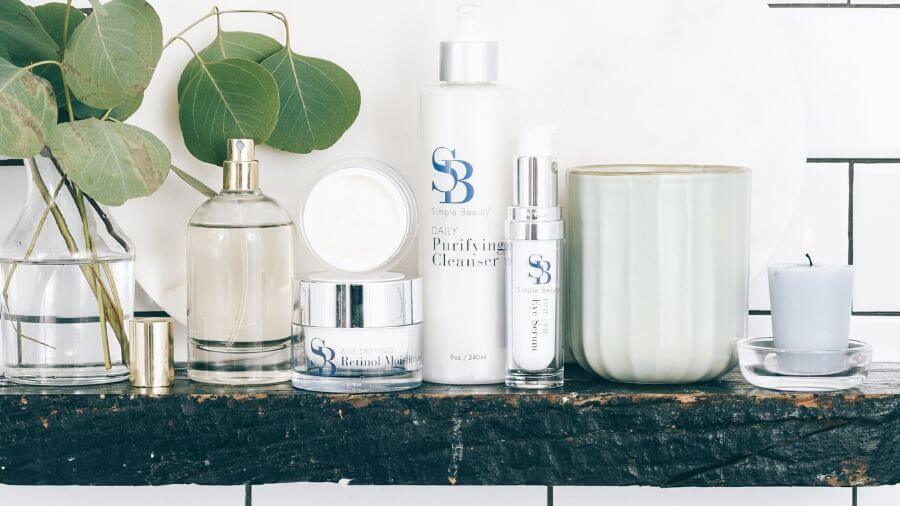
Where is `shelf`? This screenshot has height=506, width=900. shelf is located at coordinates (577, 412).